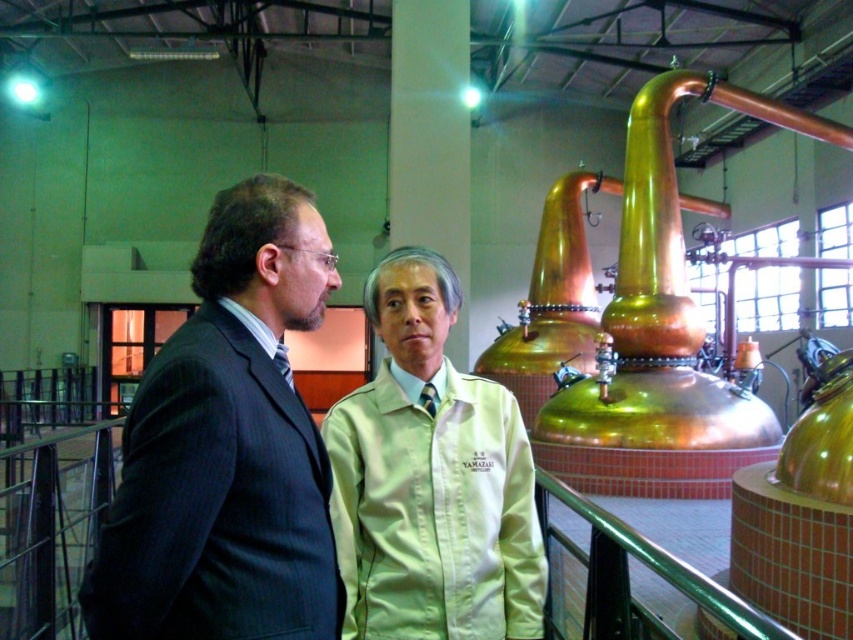
Question: Among these objects, which one is farthest from the camera?

Choices:
 (A) dark gray pinstripe suit at left
 (B) light beige fabric shirt at center

Answer: (B)

Question: Which point appears farthest from the camera in this image?

Choices:
 (A) tap(392, 557)
 (B) tap(167, 353)

Answer: (A)

Question: Among these points, which one is farthest from the camera?

Choices:
 (A) (270, 397)
 (B) (437, 625)

Answer: (B)

Question: From the image, what is the correct spatial relationship of dark gray pinstripe suit at left in relation to light beige fabric shirt at center?

Choices:
 (A) above
 (B) below

Answer: (A)

Question: Considering the relative positions of dark gray pinstripe suit at left and light beige fabric shirt at center in the image provided, where is dark gray pinstripe suit at left located with respect to light beige fabric shirt at center?

Choices:
 (A) below
 (B) above

Answer: (B)

Question: Does dark gray pinstripe suit at left have a larger size compared to light beige fabric shirt at center?

Choices:
 (A) no
 (B) yes

Answer: (A)